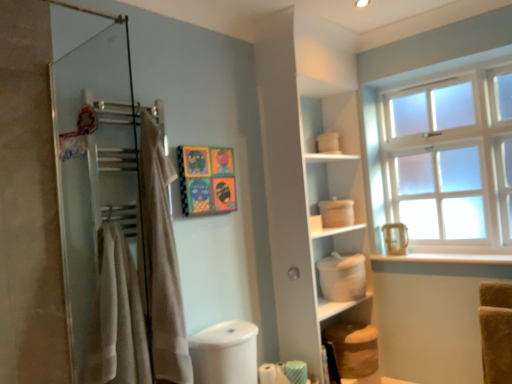
Question: Considering their positions, is white matte container at center-right located in front of or behind green striped toilet paper at lower center, the 1th toilet paper from the right?

Choices:
 (A) behind
 (B) front

Answer: (A)

Question: Is white matte container at center-right situated inside green striped toilet paper at lower center, the 1th toilet paper from the right, or outside?

Choices:
 (A) inside
 (B) outside

Answer: (B)

Question: Considering the real-world distances, which object is farthest from the white matte cabinet at center?

Choices:
 (A) white matte toilet paper at lower center, arranged as the second toilet paper when viewed from the right
 (B) beige cotton bath towel at left
 (C) beige fabric towel at left
 (D) vibrant paper collage at center
 (E) white matte container at center-right

Answer: (B)

Question: Which of these objects is positioned closest to the beige cotton bath towel at left?

Choices:
 (A) beige fabric towel at left
 (B) white matte cabinet at center
 (C) vibrant paper collage at center
 (D) white matte toilet paper at lower center, arranged as the second toilet paper when viewed from the right
 (E) green striped toilet paper at lower center, marked as the second toilet paper in a left-to-right arrangement

Answer: (A)